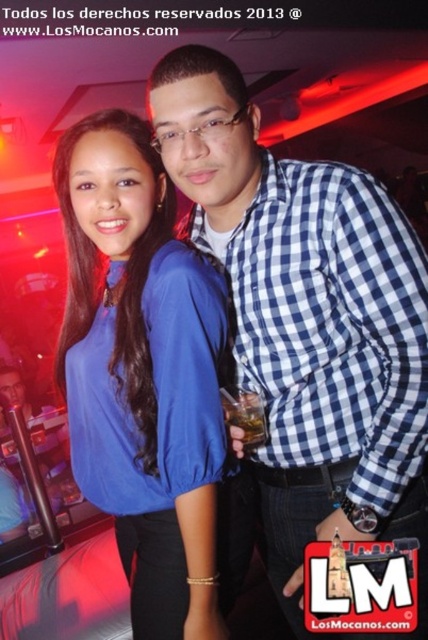
You are a photographer who needs to adjust the lighting for a photo shoot. You notice two blue items in the scene, the blue checkered shirt at center and the matte blue blouse at center. Which of these items requires more light to ensure it stands out in the final photo?

The blue checkered shirt at center has a larger size compared to matte blue blouse at center, so it requires more light to ensure it stands out in the final photo.

You are a photographer adjusting your camera settings to focus on two points in the image. The first point is at coordinates point (x=214, y=240) and the second point is at point (x=130, y=232). Which point should you focus on first if you want to capture the closest object to the camera?

Point (x=214, y=240) is closer to the camera than point (x=130, y=232), so you should focus on point (x=214, y=240) first to capture the closest object.

You are a photographer at the event and need to adjust the lighting to ensure both the blue checkered shirt at center and the matte blue blouse at center are well illuminated. Given their sizes, which one might require more focused lighting to cover its entire surface?

The blue checkered shirt at center has a larger width than the matte blue blouse at center, so it might require more focused lighting to cover its entire surface.